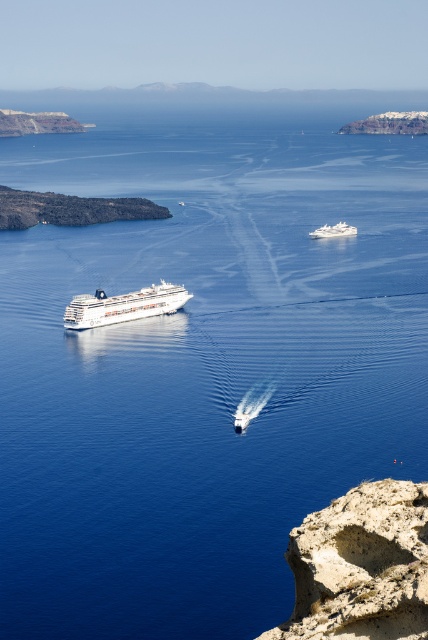
Question: Which point is farther to the camera?

Choices:
 (A) (321, 230)
 (B) (139, 289)

Answer: (A)

Question: Does white glossy cruise ship at center have a greater width compared to white glossy yacht at upper center?

Choices:
 (A) no
 (B) yes

Answer: (B)

Question: Can you confirm if white glossy cruise ship at center is positioned below white glossy yacht at upper center?

Choices:
 (A) no
 (B) yes

Answer: (B)

Question: Which point is closer to the camera taking this photo?

Choices:
 (A) (74, 323)
 (B) (330, 234)

Answer: (A)

Question: Does white glossy cruise ship at center come in front of white glossy yacht at upper center?

Choices:
 (A) yes
 (B) no

Answer: (A)